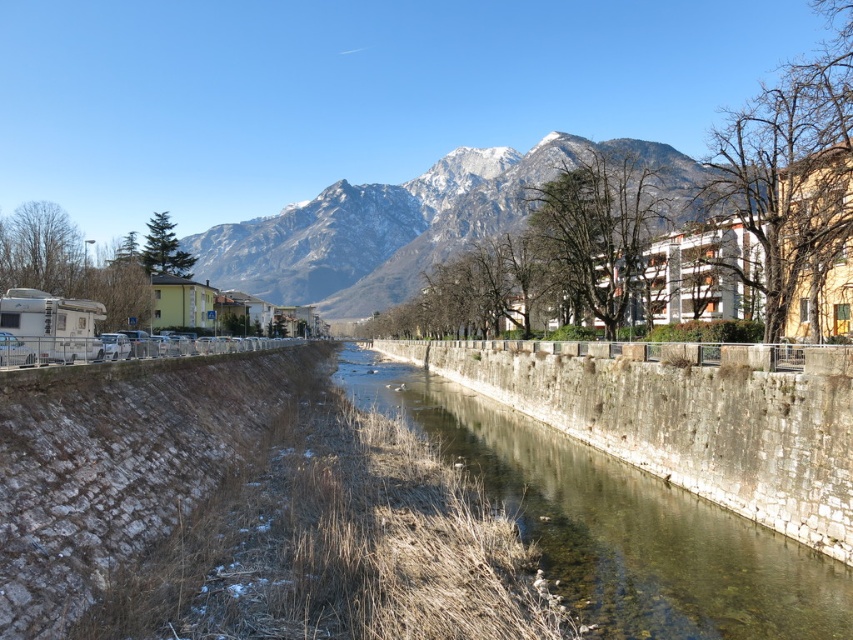
You are standing at the point with coordinates point (355,186) and want to walk towards the river. There is a point at point (561,552). Which direction should you go to reach the river first?

You should go towards point (561,552) because it is in front of point (355,186), meaning it is closer to the river and the direction towards it would lead you to the river more quickly.

You are a painter wanting to capture the scene of the clear stone wall at center and the snowy rock mountain at upper center in your painting. Which object should you focus on first if you want to emphasize the narrower structure in your artwork?

The clear stone wall at center has a narrower width compared to the snowy rock mountain at upper center, so you should focus on the clear stone wall at center first to emphasize its narrower structure.

From the picture: You are standing at the edge of the river on the left side and want to cross to the right side. The clear stone wall at center is in your way. Can you walk around it to reach the right side?

The clear stone wall at center is positioned at point (614, 524), so if you walk along the riverbank towards either end of the wall, you can go around it to reach the right side.